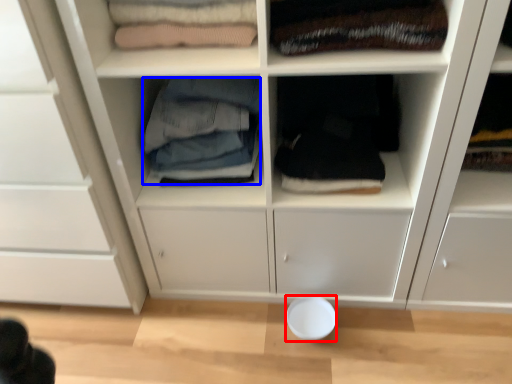
Question: Among these objects, which one is nearest to the camera, bowl (highlighted by a red box) or clothing (highlighted by a blue box)?

Choices:
 (A) bowl
 (B) clothing

Answer: (B)